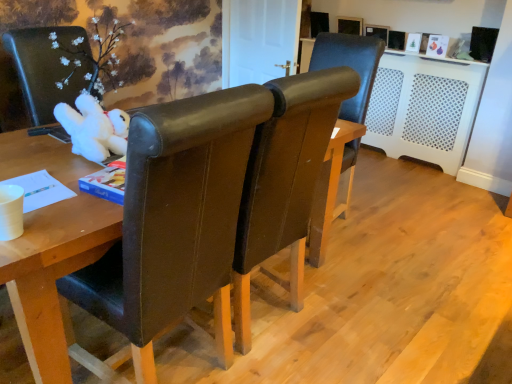
Locate an element on the screen. The image size is (512, 384). vacant space to the right of brown leather chair at center, which is counted as the second chair, starting from the back is located at coordinates (367, 316).